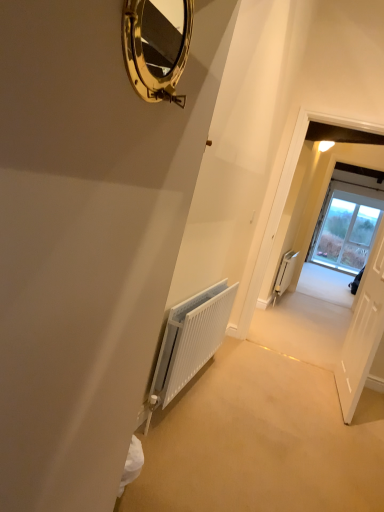
Question: Could gold polished mirror at upper center be considered to be inside white matte radiator at right, the first radiator from the right?

Choices:
 (A) no
 (B) yes

Answer: (A)

Question: Considering the relative sizes of white matte radiator at right, positioned as the second radiator in left-to-right order, and gold polished mirror at upper center in the image provided, is white matte radiator at right, positioned as the second radiator in left-to-right order, thinner than gold polished mirror at upper center?

Choices:
 (A) no
 (B) yes

Answer: (A)

Question: Is white matte radiator at right, which ranks as the 1th radiator in back-to-front order, positioned in front of gold polished mirror at upper center?

Choices:
 (A) yes
 (B) no

Answer: (B)

Question: Is white matte radiator at right, positioned as the second radiator in left-to-right order, shorter than gold polished mirror at upper center?

Choices:
 (A) no
 (B) yes

Answer: (A)

Question: Does white matte radiator at right, which appears as the 2th radiator when viewed from the front, have a greater height compared to gold polished mirror at upper center?

Choices:
 (A) yes
 (B) no

Answer: (A)

Question: Are white matte radiator at right, which appears as the 2th radiator when viewed from the front, and gold polished mirror at upper center located far from each other?

Choices:
 (A) no
 (B) yes

Answer: (B)

Question: Does gold polished mirror at upper center have a lesser width compared to white matte radiator at right, which ranks as the 1th radiator in back-to-front order?

Choices:
 (A) yes
 (B) no

Answer: (A)

Question: Is gold polished mirror at upper center surrounding white matte radiator at right, positioned as the second radiator in left-to-right order?

Choices:
 (A) no
 (B) yes

Answer: (A)

Question: From a real-world perspective, is gold polished mirror at upper center located higher than white matte radiator at right, positioned as the second radiator in left-to-right order?

Choices:
 (A) yes
 (B) no

Answer: (A)

Question: Does gold polished mirror at upper center have a lesser height compared to white matte radiator at right, which appears as the 2th radiator when viewed from the front?

Choices:
 (A) no
 (B) yes

Answer: (B)

Question: Is the depth of gold polished mirror at upper center greater than that of white matte radiator at right, positioned as the second radiator in left-to-right order?

Choices:
 (A) yes
 (B) no

Answer: (B)

Question: Does gold polished mirror at upper center touch white matte radiator at right, positioned as the second radiator in left-to-right order?

Choices:
 (A) yes
 (B) no

Answer: (B)

Question: From the image's perspective, is white textured radiator at center, placed as the second radiator when sorted from right to left, beneath white matte radiator at right, which ranks as the 1th radiator in back-to-front order?

Choices:
 (A) yes
 (B) no

Answer: (A)